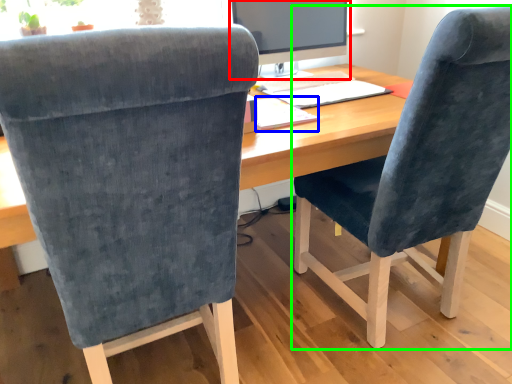
Question: Which is farther away from computer monitor (highlighted by a red box)? notepad (highlighted by a blue box) or chair (highlighted by a green box)?

Choices:
 (A) notepad
 (B) chair

Answer: (B)